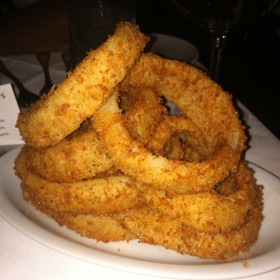
Identify the location of crumb. Image resolution: width=280 pixels, height=280 pixels. (248, 267), (118, 250), (29, 216).